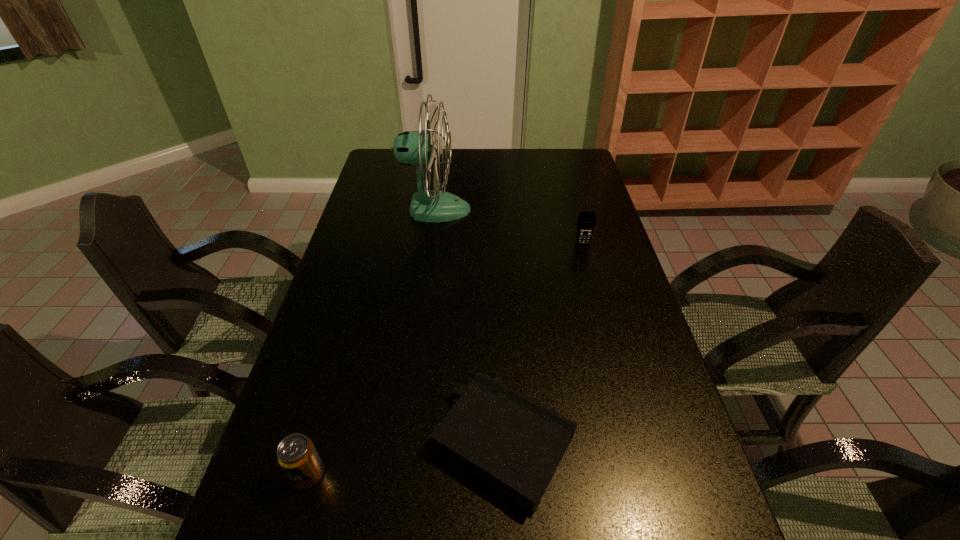
In order to click on free area in between the tallest object and the leftmost object in this screenshot , I will do `click(372, 342)`.

The image size is (960, 540). Find the location of `free space between the farthest object and the soda can`. free space between the farthest object and the soda can is located at coordinates (372, 342).

At what (x,y) coordinates should I click in order to perform the action: click on blank region between the rightmost object and the shortest object. Please return your answer as a coordinate pair (x, y). Looking at the image, I should click on (543, 343).

Image resolution: width=960 pixels, height=540 pixels. I want to click on empty space that is in between the second farthest object and the shortest object, so click(x=543, y=343).

You are a GUI agent. You are given a task and a screenshot of the screen. Output one action in this format:
    pyautogui.click(x=<x>, y=<y>)
    Task: Click on the free space between the fan and the leftmost object
    The image size is (960, 540).
    Given the screenshot: What is the action you would take?
    pyautogui.click(x=372, y=342)

The image size is (960, 540). What are the coordinates of `object that is the second closest to the soda can` in the screenshot? It's located at (412, 148).

Where is `object that is the nearest to the soda can`? The width and height of the screenshot is (960, 540). object that is the nearest to the soda can is located at coordinates (514, 443).

Where is `blank area in the image that satisfies the following two spatial constraints: 1. in front of the Bible, directing airflow; 2. on the left side of the fan`? blank area in the image that satisfies the following two spatial constraints: 1. in front of the Bible, directing airflow; 2. on the left side of the fan is located at coordinates (404, 442).

Locate an element on the screen. The height and width of the screenshot is (540, 960). free space that satisfies the following two spatial constraints: 1. in front of the shortest object, directing airflow; 2. on the left side of the fan is located at coordinates (404, 442).

Identify the location of vacant space that satisfies the following two spatial constraints: 1. in front of the farthest object, directing airflow; 2. on the back side of the Bible. (404, 442).